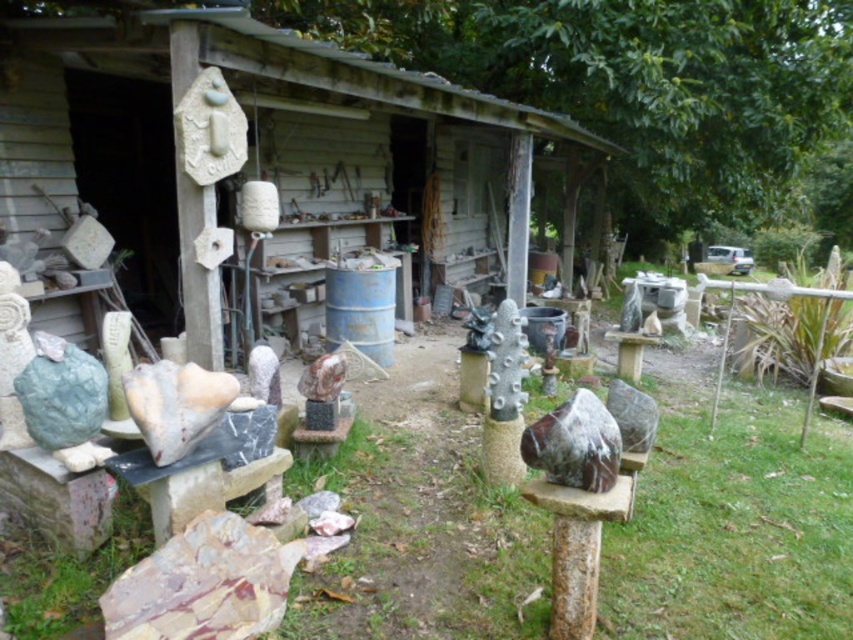
You are a visitor standing in front of the rustic wood hut at center and the marble sculpture at center. Which object is located to the right side?

The marble sculpture at center is located to the right of the rustic wood hut at center.